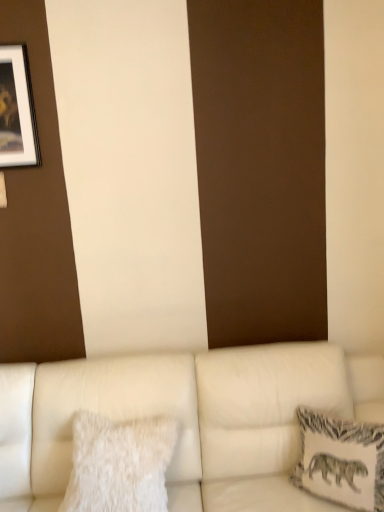
Question: Considering the relative positions of white leather couch at lower center and matte black picture frame at upper left in the image provided, is white leather couch at lower center to the left or to the right of matte black picture frame at upper left?

Choices:
 (A) right
 (B) left

Answer: (A)

Question: From the image's perspective, is white leather couch at lower center above or below matte black picture frame at upper left?

Choices:
 (A) above
 (B) below

Answer: (B)

Question: Which of these objects is positioned farthest from the white fluffy pillow at lower left, acting as the second pillow starting from the right?

Choices:
 (A) white textured pillow at right, acting as the first pillow starting from the right
 (B) matte black picture frame at upper left
 (C) white leather couch at lower center

Answer: (B)

Question: Estimate the real-world distances between objects in this image. Which object is farther from the white leather couch at lower center?

Choices:
 (A) white fluffy pillow at lower left, acting as the second pillow starting from the right
 (B) matte black picture frame at upper left
 (C) white textured pillow at right, arranged as the second pillow when viewed from the left

Answer: (B)